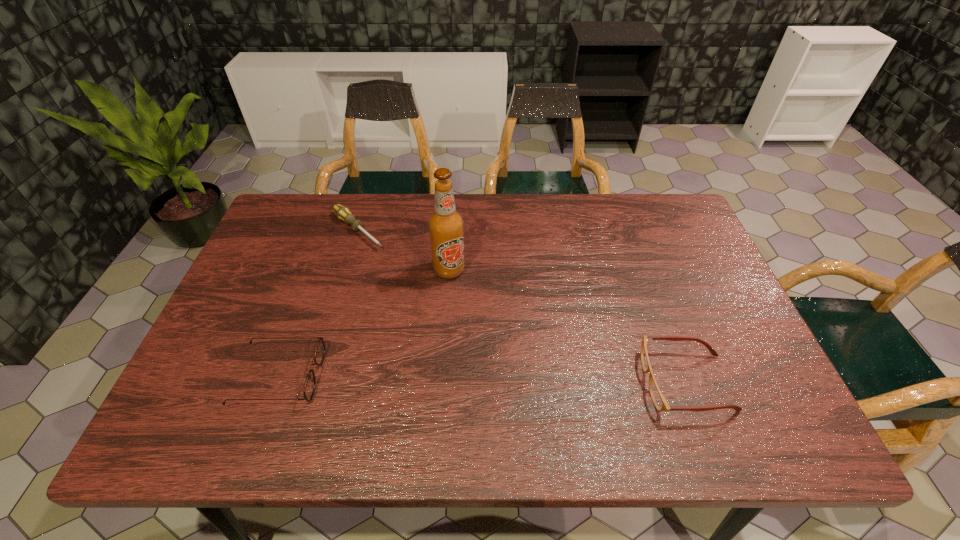
I want to click on free space located at the tip of the shortest object, so click(x=462, y=322).

Where is `free space located at the tip of the shortest object`? This screenshot has width=960, height=540. free space located at the tip of the shortest object is located at coordinates (402, 271).

Where is `vacant region located at the tip of the shortest object`? This screenshot has height=540, width=960. vacant region located at the tip of the shortest object is located at coordinates (398, 267).

At what (x,y) coordinates should I click in order to perform the action: click on vacant area located on the front label of the second object from right to left. Please return your answer as a coordinate pair (x, y). The height and width of the screenshot is (540, 960). Looking at the image, I should click on (462, 315).

Where is `vacant space positioned 0.230m on the front label of the second object from right to left`? This screenshot has height=540, width=960. vacant space positioned 0.230m on the front label of the second object from right to left is located at coordinates pyautogui.click(x=471, y=350).

This screenshot has height=540, width=960. I want to click on vacant space positioned 0.210m on the front label of the second object from right to left, so click(x=469, y=343).

Identify the location of object present at the far edge. (343, 213).

At what (x,y) coordinates should I click in order to perform the action: click on sunglasses at the near edge. Please return your answer as a coordinate pair (x, y). This screenshot has width=960, height=540. Looking at the image, I should click on (309, 388).

At what (x,y) coordinates should I click in order to perform the action: click on spectacles at the near edge. Please return your answer as a coordinate pair (x, y). This screenshot has width=960, height=540. Looking at the image, I should click on (658, 398).

I want to click on object situated at the left edge, so click(x=309, y=388).